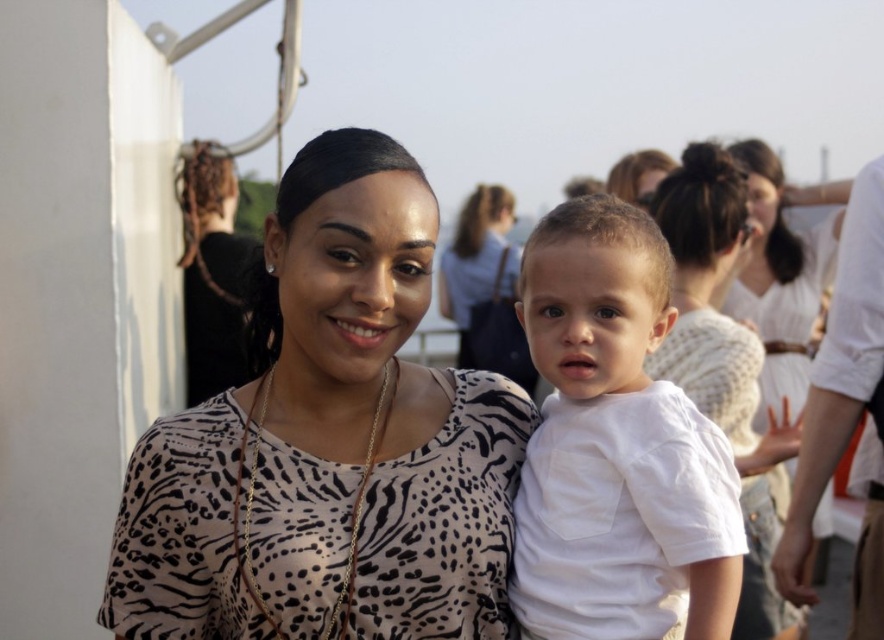
Does leopard print blouse at center have a lesser height compared to white cotton shirt at center?

No.

Which is above, leopard print blouse at center or white cotton shirt at center?

white cotton shirt at center

Which is behind, point (341, 314) or point (684, 512)?

The point (341, 314) is more distant.

Identify the location of leopard print blouse at center. (329, 442).

Does point (542, 436) come closer to viewer compared to point (494, 186)?

Yes, point (542, 436) is in front of point (494, 186).

Between white cotton shirt at center and matte black shirt at center, which one is positioned higher?

matte black shirt at center is higher up.

Is point (557, 420) closer to camera compared to point (478, 189)?

Yes, it is.

You are a GUI agent. You are given a task and a screenshot of the screen. Output one action in this format:
    pyautogui.click(x=<x>, y=<y>)
    Task: Click on the white cotton shirt at center
    
    Given the screenshot: What is the action you would take?
    click(x=616, y=445)

Is white matte shirt at center behind matte black shirt at center?

No, white matte shirt at center is in front of matte black shirt at center.

This screenshot has height=640, width=884. I want to click on white matte shirt at center, so click(x=725, y=365).